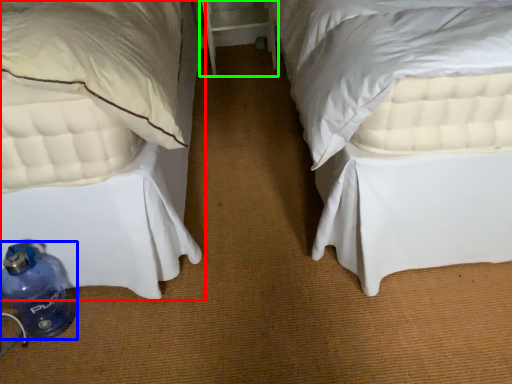
Question: Considering the real-world distances, which object is closest to bed (highlighted by a red box)? bottle (highlighted by a blue box) or table (highlighted by a green box).

Choices:
 (A) bottle
 (B) table

Answer: (A)